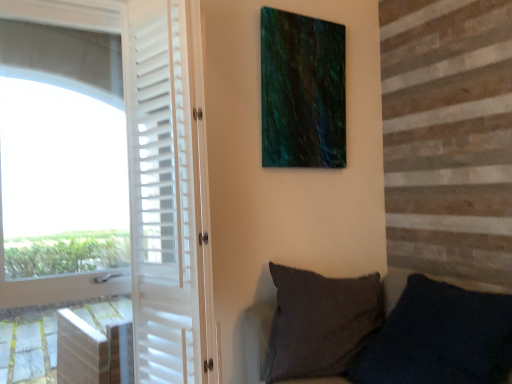
Locate an element on the screen. The width and height of the screenshot is (512, 384). dark gray fabric pillow at lower right is located at coordinates (439, 338).

Locate an element on the screen. Image resolution: width=512 pixels, height=384 pixels. white matte screen door at left is located at coordinates (162, 196).

Image resolution: width=512 pixels, height=384 pixels. What are the coordinates of `green textured canvas at upper center` in the screenshot? It's located at (302, 91).

Does white matte door at left have a lesser height compared to white matte screen door at left?

No, white matte door at left is not shorter than white matte screen door at left.

Between white matte door at left and white matte screen door at left, which one has smaller size?

Smaller between the two is white matte screen door at left.

From the image's perspective, is white matte door at left beneath white matte screen door at left?

Yes, from the image's perspective, white matte door at left is below white matte screen door at left.

Does white matte door at left turn towards white matte screen door at left?

Yes, white matte door at left is oriented towards white matte screen door at left.

Could you tell me if dark gray fabric pillow at lower right is turned towards white matte door at left?

No.

Locate an element on the screen. pillow below the white matte door at left (from the image's perspective) is located at coordinates (439, 338).

Which point is more distant from viewer, [505,354] or [188,245]?

Point [188,245]

Considering the positions of objects dark gray fabric pillow at lower right and white matte door at left in the image provided, who is more to the right, dark gray fabric pillow at lower right or white matte door at left?

dark gray fabric pillow at lower right is more to the right.

From the image's perspective, is green textured canvas at upper center located above or below white matte door at left?

green textured canvas at upper center is situated higher than white matte door at left in the image.

Which object is more forward, green textured canvas at upper center or white matte door at left?

white matte door at left is in front.

Can you confirm if green textured canvas at upper center is thinner than white matte door at left?

Indeed, green textured canvas at upper center has a lesser width compared to white matte door at left.

Between green textured canvas at upper center and white matte door at left, which one has more height?

With more height is white matte door at left.

Between green textured canvas at upper center and white matte screen door at left, which one appears on the right side from the viewer's perspective?

green textured canvas at upper center is more to the right.

Is white matte screen door at left completely or partially inside green textured canvas at upper center?

No.

From the image's perspective, which object appears higher, green textured canvas at upper center or white matte screen door at left?

green textured canvas at upper center.

Is green textured canvas at upper center positioned with its back to white matte screen door at left?

green textured canvas at upper center is not turned away from white matte screen door at left.

Does point (142, 333) appear closer or farther from the camera than point (469, 377)?

Point (142, 333) appears to be farther away from the viewer than point (469, 377).

From a real-world perspective, which object stands above the other?

In real-world perspective, white matte door at left is above.

From the image's perspective, is white matte door at left positioned above or below dark gray fabric pillow at lower right?

Based on their image positions, white matte door at left is located above dark gray fabric pillow at lower right.

In terms of height, does white matte door at left look taller or shorter compared to dark gray fabric pillow at lower right?

Considering their sizes, white matte door at left has more height than dark gray fabric pillow at lower right.

The image size is (512, 384). In order to click on door lying below the white matte screen door at left (from the image's perspective) in this screenshot , I will do `click(154, 169)`.

Is white matte screen door at left far away from white matte door at left?

white matte screen door at left is near white matte door at left, not far away.

Could you tell me if white matte screen door at left is facing white matte door at left?

No, white matte screen door at left is not aimed at white matte door at left.

I want to click on pillow on the right of green textured canvas at upper center, so click(x=439, y=338).

Looking at this image, is green textured canvas at upper center not close to dark gray fabric pillow at lower right?

Indeed, green textured canvas at upper center is not near dark gray fabric pillow at lower right.

Is green textured canvas at upper center turned away from dark gray fabric pillow at lower right?

green textured canvas at upper center does not have its back to dark gray fabric pillow at lower right.

The image size is (512, 384). There is a white matte door at left. In order to click on screen door above it (from a real-world perspective) in this screenshot , I will do `click(162, 196)`.

You are a GUI agent. You are given a task and a screenshot of the screen. Output one action in this format:
    pyautogui.click(x=<x>, y=<y>)
    Task: Click on the pillow in front of the white matte door at left
    
    Given the screenshot: What is the action you would take?
    pyautogui.click(x=439, y=338)

Looking at the image, which one is located further to dark gray fabric pillow at lower right, green textured canvas at upper center or white matte door at left?

Among the two, green textured canvas at upper center is located further to dark gray fabric pillow at lower right.

Estimate the real-world distances between objects in this image. Which object is closer to green textured canvas at upper center, dark gray fabric pillow at lower right or white matte door at left?

white matte door at left is closer to green textured canvas at upper center.

From the image, which object appears to be nearer to white matte door at left, dark gray fabric pillow at lower right or white matte screen door at left?

white matte screen door at left is positioned closer to the anchor white matte door at left.

Estimate the real-world distances between objects in this image. Which object is closer to green textured canvas at upper center, white matte door at left or dark gray fabric pillow at lower right?

The object closer to green textured canvas at upper center is white matte door at left.

When comparing their distances from white matte screen door at left, does white matte door at left or dark gray fabric pillow at lower right seem further?

dark gray fabric pillow at lower right lies further to white matte screen door at left than the other object.

Which object lies nearer to the anchor point white matte screen door at left, green textured canvas at upper center or white matte door at left?

white matte door at left is closer to white matte screen door at left.

Considering their positions, is dark gray fabric pillow at lower right positioned further to green textured canvas at upper center than white matte screen door at left?

Among the two, dark gray fabric pillow at lower right is located further to green textured canvas at upper center.

Looking at the image, which one is located closer to white matte door at left, green textured canvas at upper center or dark gray fabric pillow at lower right?

Among the two, green textured canvas at upper center is located nearer to white matte door at left.

What are the coordinates of `screen door that lies between green textured canvas at upper center and dark gray fabric pillow at lower right from top to bottom` in the screenshot? It's located at (162, 196).

Where is `picture frame between white matte door at left and dark gray fabric pillow at lower right from left to right`? The image size is (512, 384). picture frame between white matte door at left and dark gray fabric pillow at lower right from left to right is located at coordinates (302, 91).

Locate an element on the screen. This screenshot has width=512, height=384. screen door located between white matte door at left and dark gray fabric pillow at lower right in the left-right direction is located at coordinates (162, 196).

The width and height of the screenshot is (512, 384). What are the coordinates of `screen door between white matte door at left and green textured canvas at upper center` in the screenshot? It's located at (162, 196).